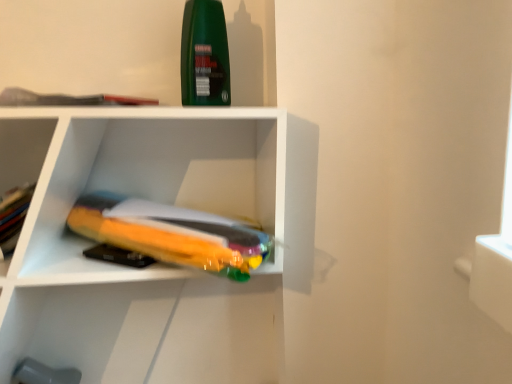
Where is `free space above translucent orange book at center, which appears as the second book when viewed from the top (from a real-world perspective)`? free space above translucent orange book at center, which appears as the second book when viewed from the top (from a real-world perspective) is located at coordinates (145, 213).